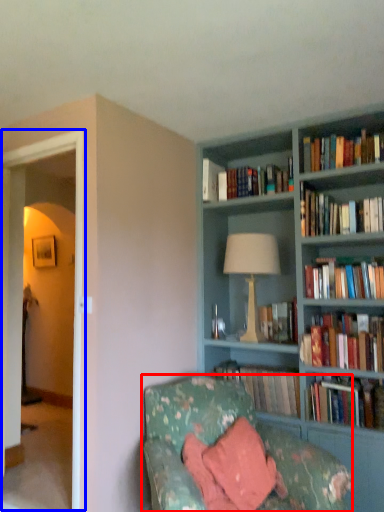
Question: Among these objects, which one is nearest to the camera, studio couch (highlighted by a red box) or glass door (highlighted by a blue box)?

Choices:
 (A) studio couch
 (B) glass door

Answer: (A)